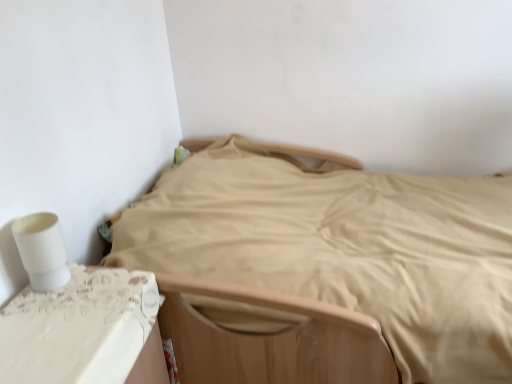
Where is `vacant space to the right of white matte toilet paper at left`? The width and height of the screenshot is (512, 384). vacant space to the right of white matte toilet paper at left is located at coordinates (102, 289).